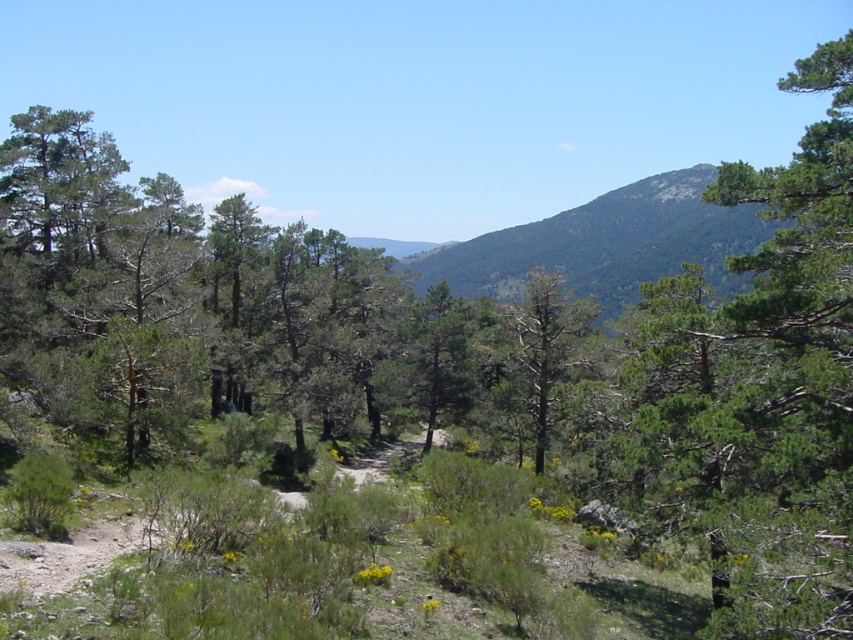
Question: Which of the following is the closest to the observer?

Choices:
 (A) green leafy tree at upper right
 (B) green textured tree at center

Answer: (A)

Question: Does green leafy tree at upper right appear under green leafy hillside at center?

Choices:
 (A) yes
 (B) no

Answer: (A)

Question: Does green leafy tree at upper right come in front of green leafy hillside at center?

Choices:
 (A) no
 (B) yes

Answer: (B)

Question: Which point is closer to the camera taking this photo?

Choices:
 (A) [575, 324]
 (B) [561, 230]

Answer: (A)

Question: In this image, where is green leafy tree at upper right located relative to green leafy hillside at center?

Choices:
 (A) right
 (B) left

Answer: (B)

Question: Among these points, which one is nearest to the camera?

Choices:
 (A) (537, 291)
 (B) (758, 563)
 (C) (614, 244)

Answer: (B)